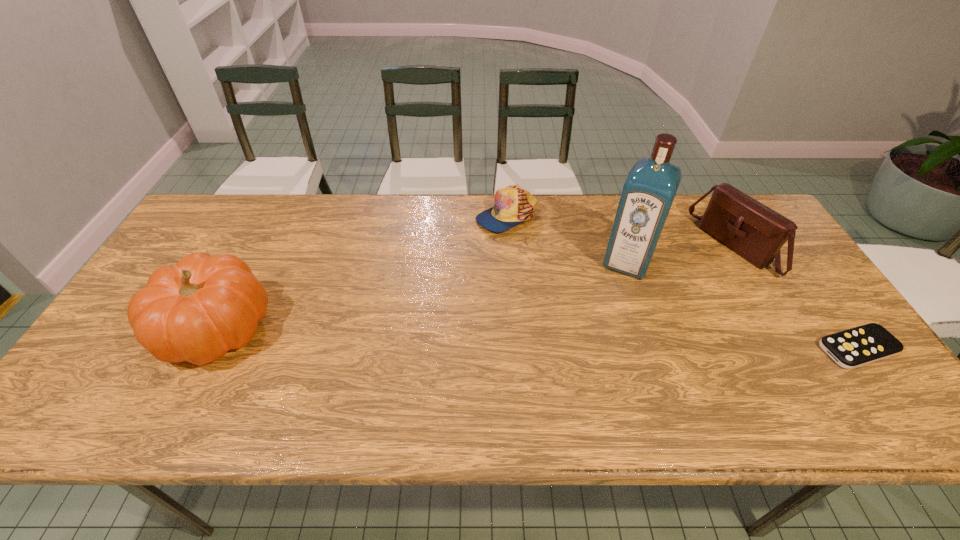
Where is `vacant space at the near edge`? The image size is (960, 540). vacant space at the near edge is located at coordinates (296, 364).

In the image, there is a desktop. In order to click on free space at the far left corner in this screenshot , I will do `click(226, 219)`.

Where is `free space that is in between the shortest object and the second object from left to right`? The image size is (960, 540). free space that is in between the shortest object and the second object from left to right is located at coordinates (682, 282).

Where is `vacant space in between the cap and the leftmost object`? The image size is (960, 540). vacant space in between the cap and the leftmost object is located at coordinates (361, 272).

Where is `unoccupied position between the tallest object and the fourth object from right to left`? This screenshot has height=540, width=960. unoccupied position between the tallest object and the fourth object from right to left is located at coordinates (566, 239).

This screenshot has width=960, height=540. I want to click on vacant point located between the leftmost object and the shoulder bag, so click(x=475, y=288).

Identify the location of empty space between the third tallest object and the remote control. The width and height of the screenshot is (960, 540). (796, 298).

Find the location of a particular element. empty space between the pumpkin and the shortest object is located at coordinates point(537,339).

Where is `blank region between the remote control and the fourth tallest object`? blank region between the remote control and the fourth tallest object is located at coordinates (682, 282).

Where is `free space between the liquor and the shoulder bag`? The width and height of the screenshot is (960, 540). free space between the liquor and the shoulder bag is located at coordinates (681, 254).